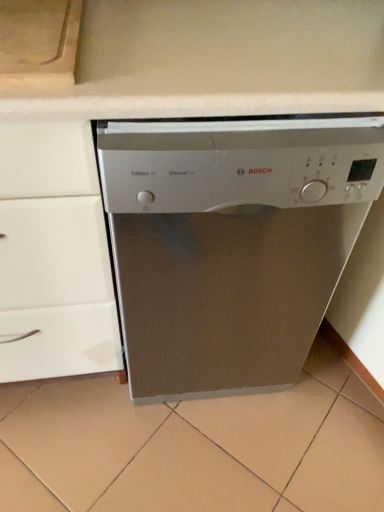
Question: Should I look upward or downward to see satin silver dishwasher at center?

Choices:
 (A) down
 (B) up

Answer: (B)